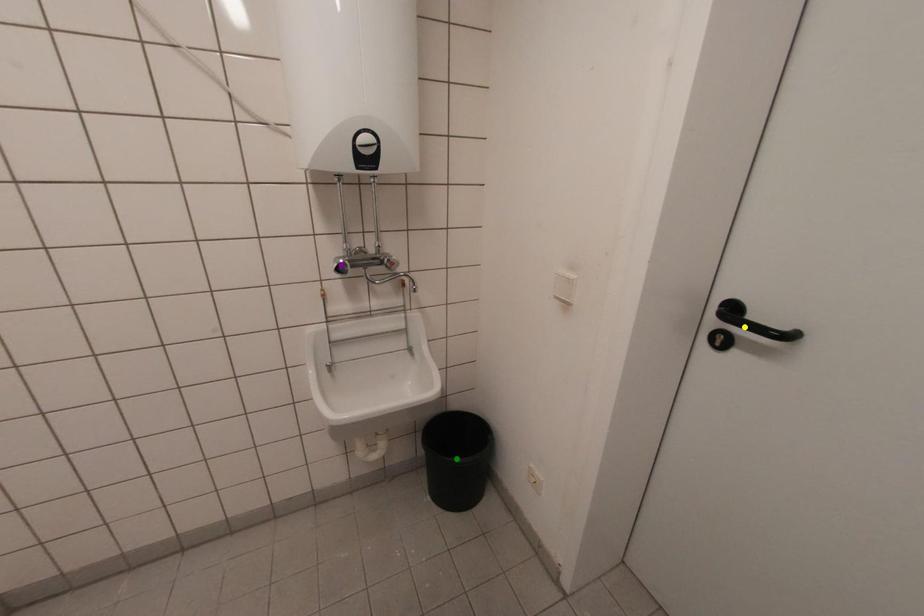
Order these from nearest to farthest:
green point, yellow point, purple point

1. yellow point
2. purple point
3. green point